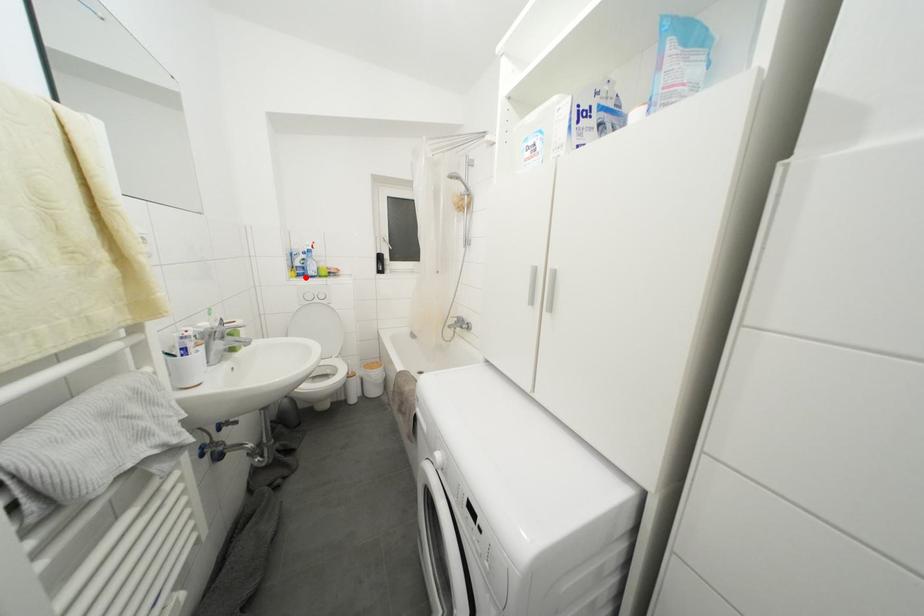
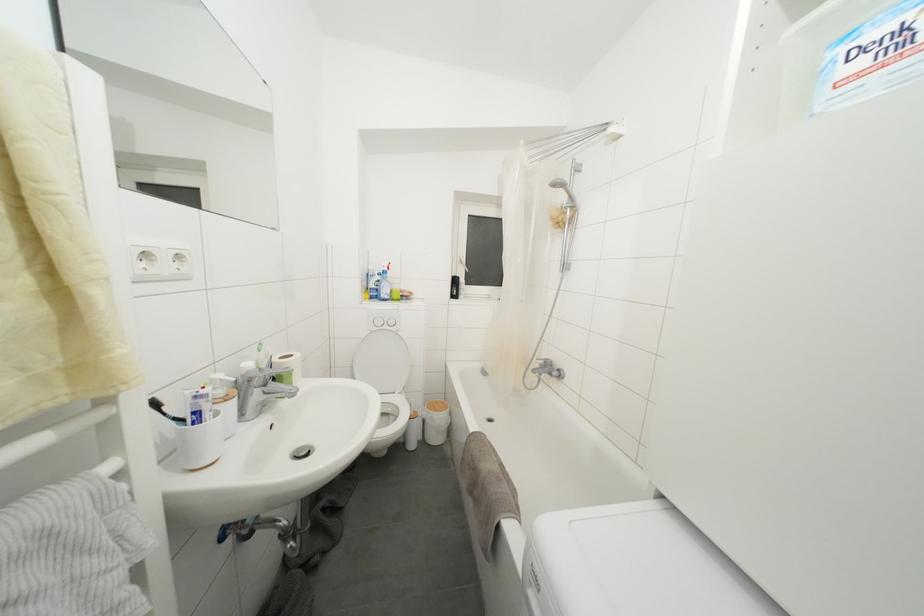
Locate, in the second image, the point that corresponds to the highlighted location in the first image.

(379, 300)